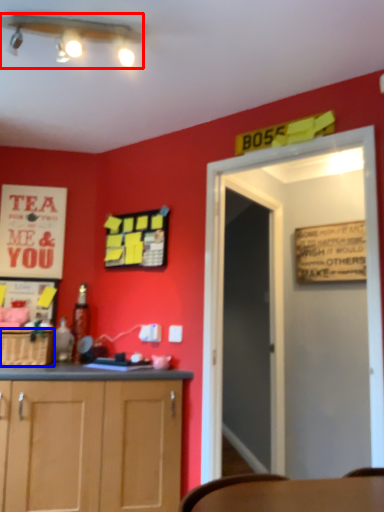
Question: Among these objects, which one is farthest to the camera, light fixture (highlighted by a red box) or cabinetry (highlighted by a blue box)?

Choices:
 (A) light fixture
 (B) cabinetry

Answer: (B)